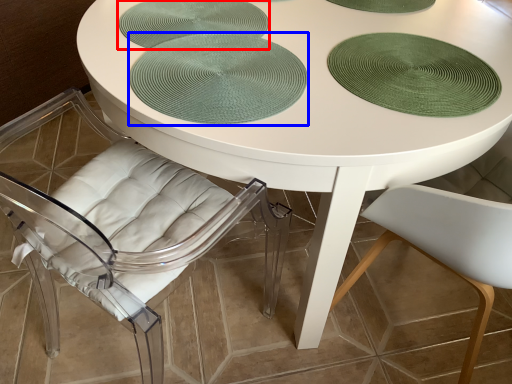
Question: Among these objects, which one is nearest to the camera, glass plate (highlighted by a red box) or poker table (highlighted by a blue box)?

Choices:
 (A) glass plate
 (B) poker table

Answer: (B)